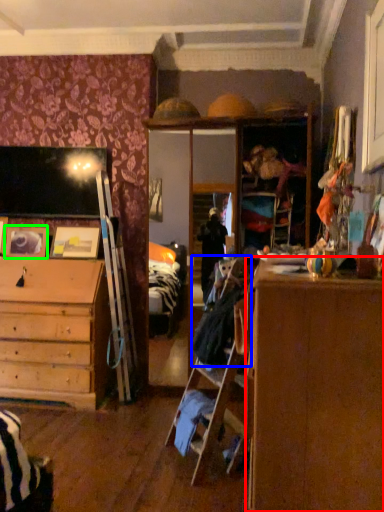
Question: Which is farther away from cabinetry (highlighted by a red box)? laundry (highlighted by a blue box) or picture frame (highlighted by a green box)?

Choices:
 (A) laundry
 (B) picture frame

Answer: (B)